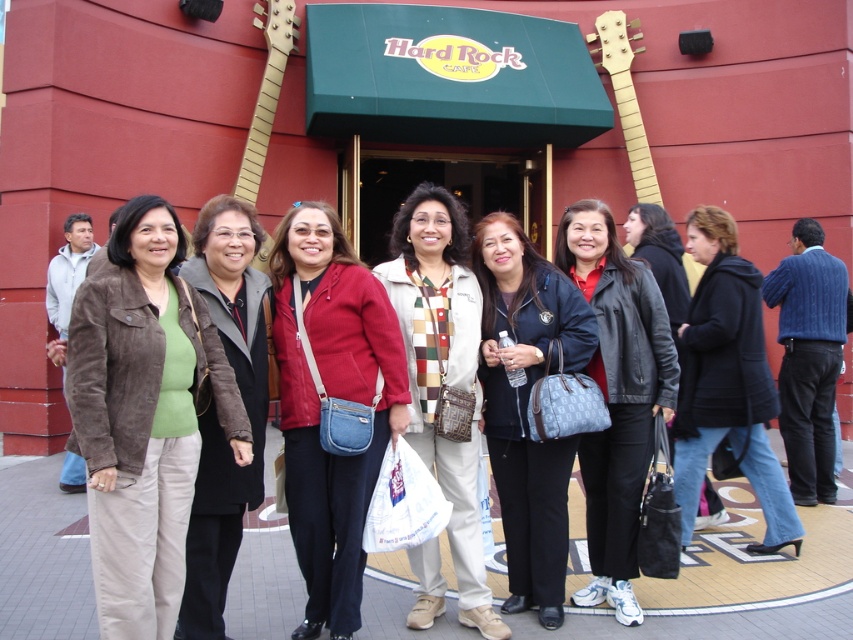
Question: Which point is farther from the camera taking this photo?

Choices:
 (A) (437, 595)
 (B) (171, 458)
 (C) (798, 518)
 (D) (601, 595)

Answer: (C)

Question: Is matte beige scarf at center to the left of dark blue jacket at center from the viewer's perspective?

Choices:
 (A) no
 (B) yes

Answer: (B)

Question: Which point is farther to the camera?

Choices:
 (A) brown suede jacket at left
 (B) leather jacket at center

Answer: (B)

Question: Does dark blue jacket at center appear under brown suede jacket at left?

Choices:
 (A) no
 (B) yes

Answer: (A)

Question: Among these objects, which one is farthest from the camera?

Choices:
 (A) denim jacket at center
 (B) dark blue jacket at center
 (C) suede brown jacket at center

Answer: (B)

Question: Can you confirm if denim jacket at center is smaller than leather jacket at center?

Choices:
 (A) no
 (B) yes

Answer: (B)